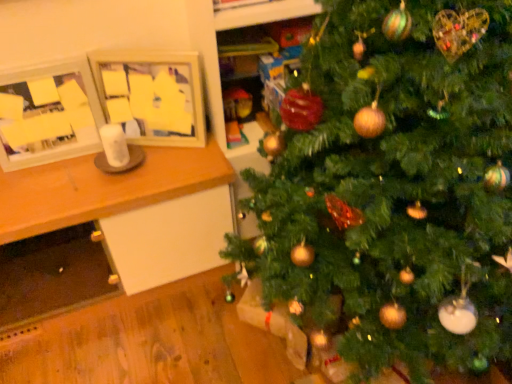
You are a GUI agent. You are given a task and a screenshot of the screen. Output one action in this format:
    pyautogui.click(x=<x>, y=<y>)
    Task: Click on the free location in front of wooden picture frame at upper left, marked as the 1th picture frame in a right-to-left arrangement
    
    Given the screenshot: What is the action you would take?
    pyautogui.click(x=150, y=170)